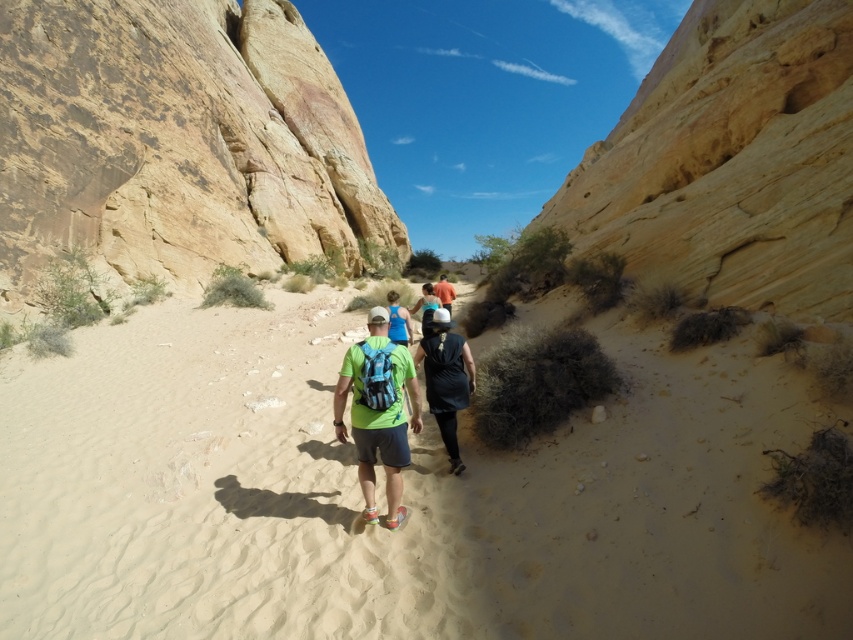
Can you confirm if rustic sandstone rock at upper left is wider than black matte backpack at center?

Yes.

You are a GUI agent. You are given a task and a screenshot of the screen. Output one action in this format:
    pyautogui.click(x=<x>, y=<y>)
    Task: Click on the rustic sandstone rock at upper left
    This screenshot has width=853, height=640.
    Given the screenshot: What is the action you would take?
    pyautogui.click(x=177, y=141)

Who is positioned more to the right, rustic sandstone rock at upper left or orange fabric shirt at center?

Positioned to the right is orange fabric shirt at center.

Measure the distance between rustic sandstone rock at upper left and camera.

rustic sandstone rock at upper left is 45.38 meters away from camera.

The height and width of the screenshot is (640, 853). I want to click on rustic sandstone rock at upper left, so click(177, 141).

Who is more forward, (357, 376) or (450, 301)?

Point (357, 376) is in front.

Who is higher up, green fabric backpack at center or orange fabric shirt at center?

orange fabric shirt at center

Who is more distant from viewer, (368, 410) or (444, 289)?

The point (444, 289) is behind.

Locate an element on the screen. This screenshot has width=853, height=640. green fabric backpack at center is located at coordinates (378, 417).